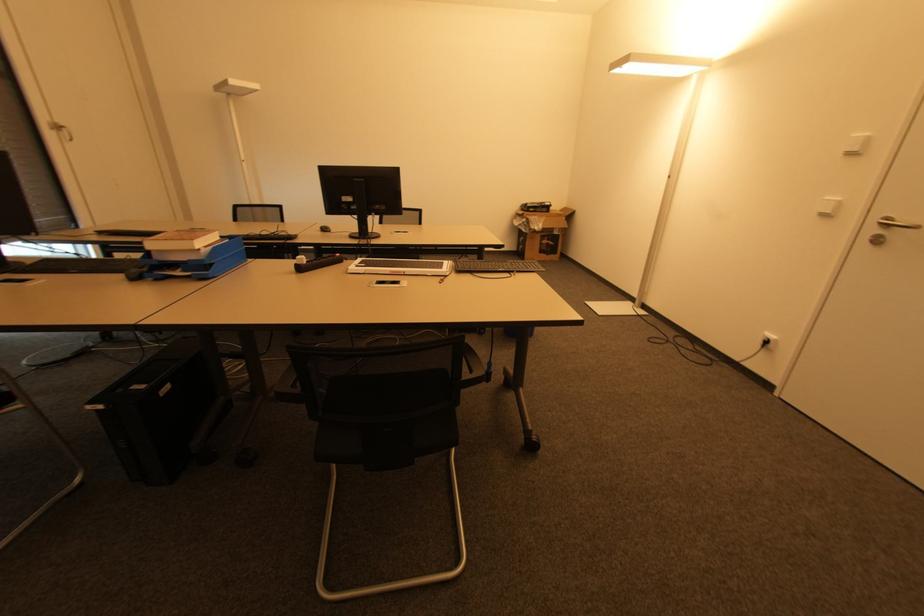
Which object does [191,261] point to?

It refers to a blue paper tray.